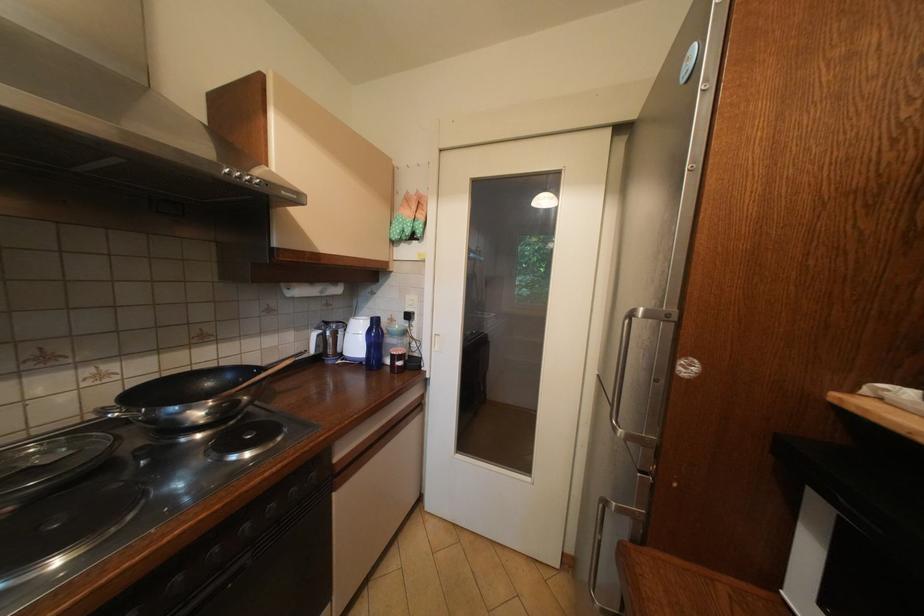
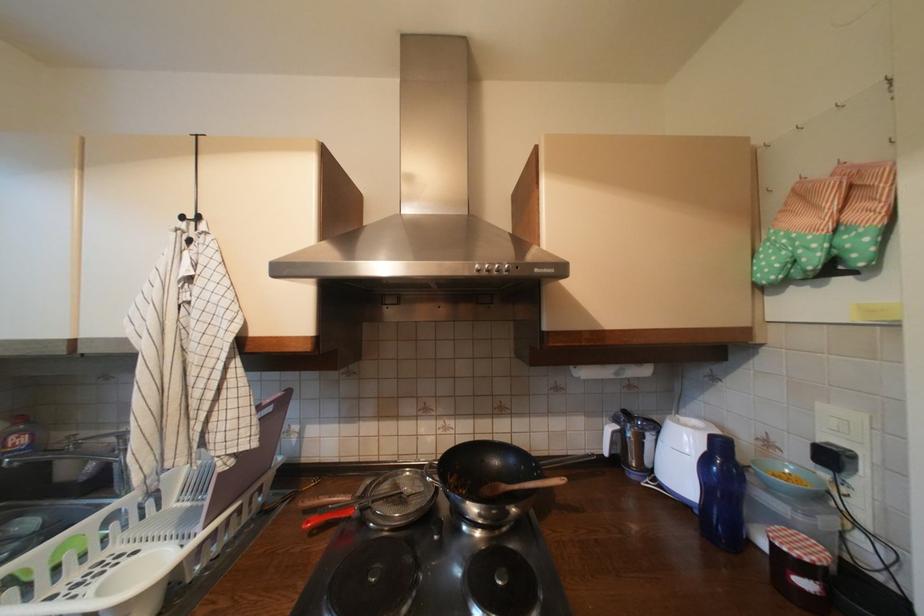
Locate, in the second image, the point that corresponds to the point at 417,317 in the first image.

(840, 459)